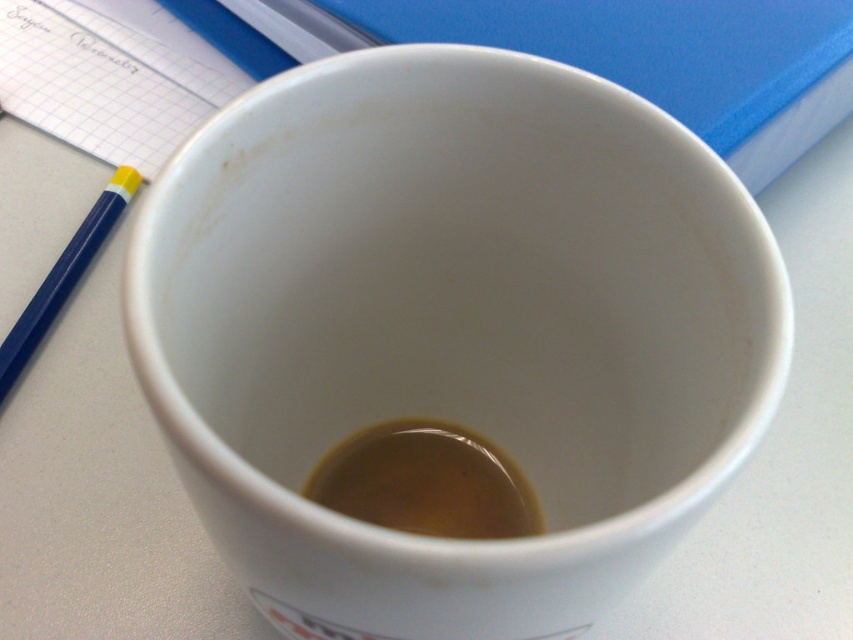
You have a white ceramic mug at center and a blue plastic pencil at left on your desk. If you want to place both items side by side without overlapping, which item should you position first to ensure there is enough space?

The white ceramic mug at center is wider than the blue plastic pencil at left, so you should position the mug first to ensure there is enough space for both items side by side without overlapping.